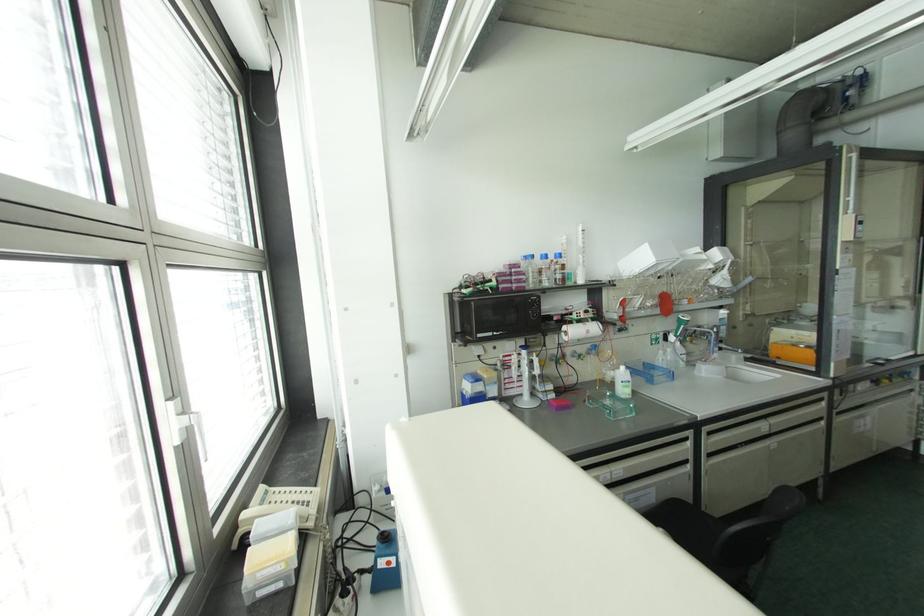
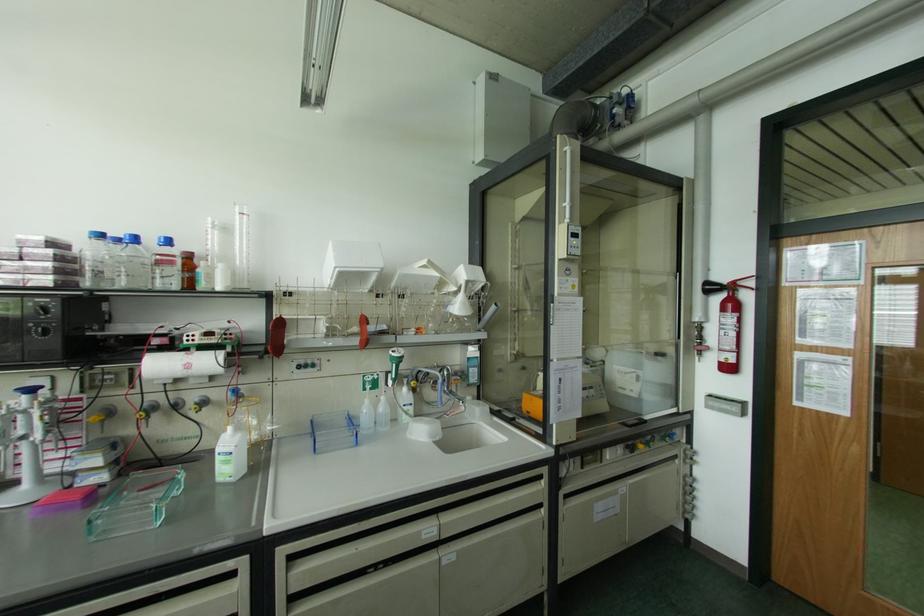
In the second image, find the point that corresponds to point 531,256 in the first image.

(101, 236)